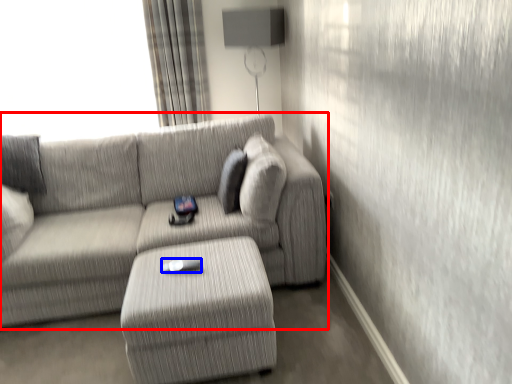
Question: Which point is further to the camera, studio couch (highlighted by a red box) or Wii controller (highlighted by a blue box)?

Choices:
 (A) studio couch
 (B) Wii controller

Answer: (B)